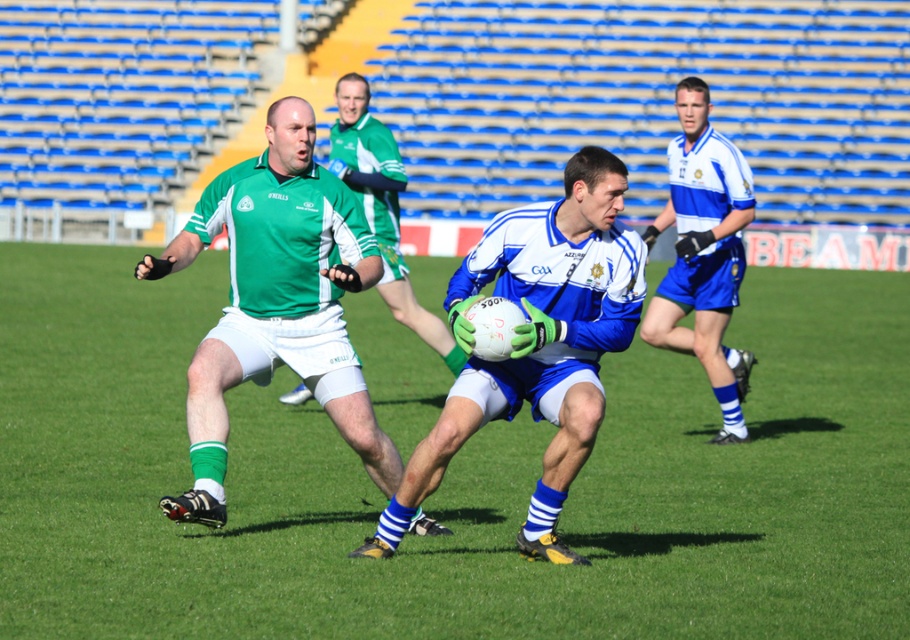
Consider the image. Which is more to the left, blue matte jersey at center or green jersey at center?

From the viewer's perspective, green jersey at center appears more on the left side.

Does blue matte jersey at center have a greater width compared to green jersey at center?

Yes, blue matte jersey at center is wider than green jersey at center.

Who is more distant from viewer, (541, 486) or (366, 202)?

Positioned behind is point (366, 202).

You are a GUI agent. You are given a task and a screenshot of the screen. Output one action in this format:
    pyautogui.click(x=<x>, y=<y>)
    Task: Click on the blue matte jersey at center
    This screenshot has width=910, height=640.
    Given the screenshot: What is the action you would take?
    pyautogui.click(x=537, y=342)

Which is behind, point (389, 460) or point (340, 156)?

Point (340, 156)

Is green jersey at left to the right of green jersey at center from the viewer's perspective?

Incorrect, green jersey at left is not on the right side of green jersey at center.

Find the location of `green jersey at left`. green jersey at left is located at coordinates (277, 301).

Where is `green jersey at left`? green jersey at left is located at coordinates (277, 301).

Which is more to the left, white/blue striped jersey at center or green jersey at center?

green jersey at center

Between white/blue striped jersey at center and green jersey at center, which one has less height?

green jersey at center

Is point (706, 92) behind point (386, 253)?

No.

Find the location of `white/blue striped jersey at center`. white/blue striped jersey at center is located at coordinates (703, 252).